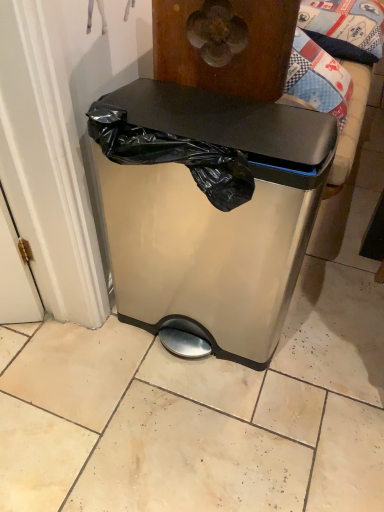
In order to click on vacant area that is situated to the right of satin silver trash can at center in this screenshot , I will do `click(327, 339)`.